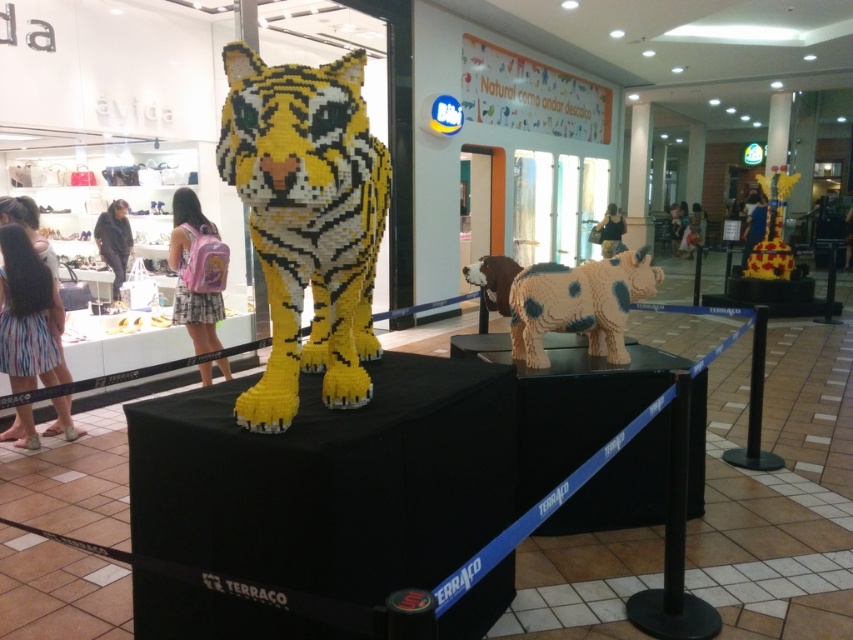
Looking at this image, is yellow lego tiger at center above speckled plastic cow at center?

Yes.

Does yellow lego tiger at center appear under speckled plastic cow at center?

No.

Where is `yellow lego tiger at center`? Image resolution: width=853 pixels, height=640 pixels. yellow lego tiger at center is located at coordinates (303, 220).